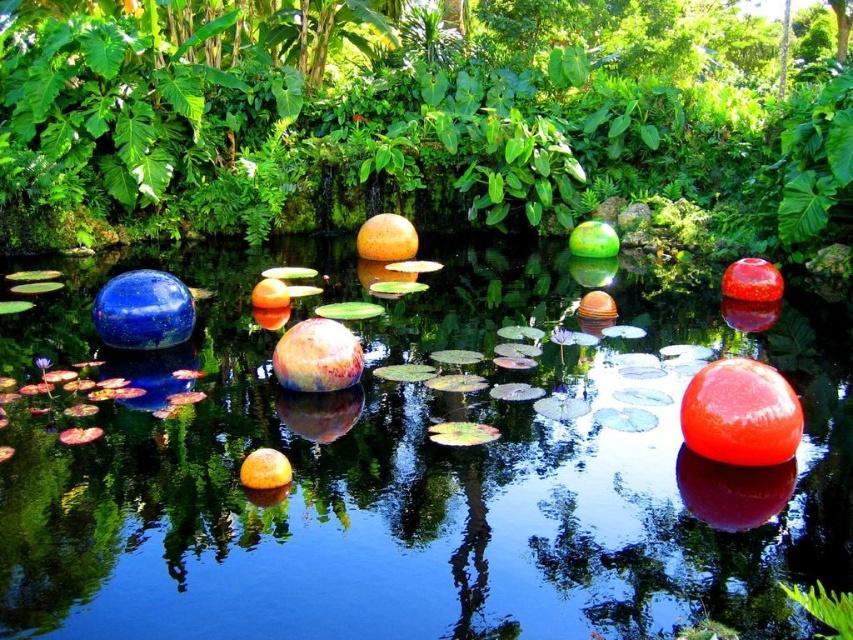
Does transparent glass water at center have a lesser width compared to green leafy tree at center?

Indeed, transparent glass water at center has a lesser width compared to green leafy tree at center.

Which is above, transparent glass water at center or green leafy tree at center?

green leafy tree at center

Between point (352, 589) and point (90, 188), which one is positioned behind?

The point (90, 188) is behind.

Locate an element on the screen. transparent glass water at center is located at coordinates (x=416, y=472).